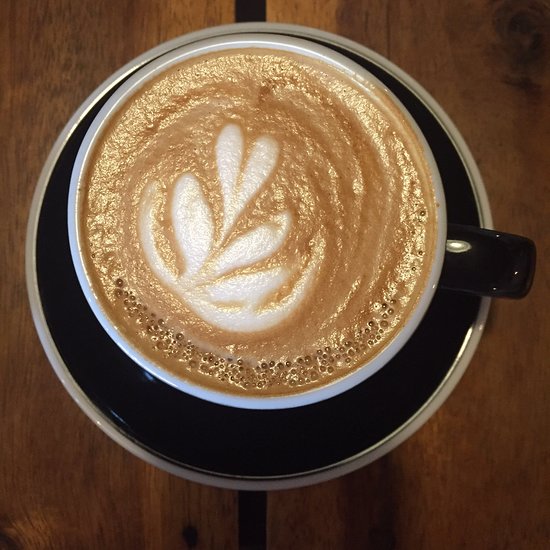
Image resolution: width=550 pixels, height=550 pixels. In order to click on small white object on side of cup in this screenshot , I will do `click(459, 246)`.